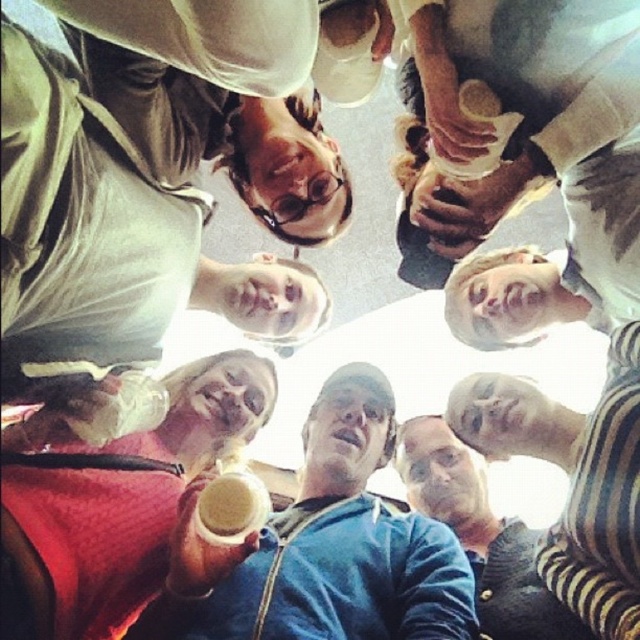
You are a photographer trying to capture a group photo of the blue fleece jacket at center and the blue denim jacket at center. The camera you are using has a minimum focusing distance of 10 inches. Will you be able to take a clear photo of both jackets without moving the camera or the jackets?

The distance between the blue fleece jacket at center and the blue denim jacket at center is 8.81 inches. Since the camera requires a minimum focusing distance of 10 inches, you will not be able to take a clear photo of both jackets without adjusting the distance between them or using a different camera setting.

You are a photographer trying to capture a group photo of the matte white hoodie at upper left and the blue fleece jacket at center. Since the background is overexposed, where should you position the two subjects relative to each other to minimize glare on their clothing?

The matte white hoodie at upper left is positioned on the left side of blue fleece jacket at center, so you should place the matte white hoodie at upper left to the left of the blue fleece jacket at center to reduce glare since the overexposed background is bright and natural sunlight is the light source.

You are a photographer trying to capture a closeup of the blue fleece jacket at center without including the matte white hoodie at upper left. Based on their positions, is this possible?

The matte white hoodie at upper left is located above the blue fleece jacket at center, so if you position your camera to focus on the blue fleece jacket at center and avoid looking upward, you can capture the closeup without including the matte white hoodie at upper left.